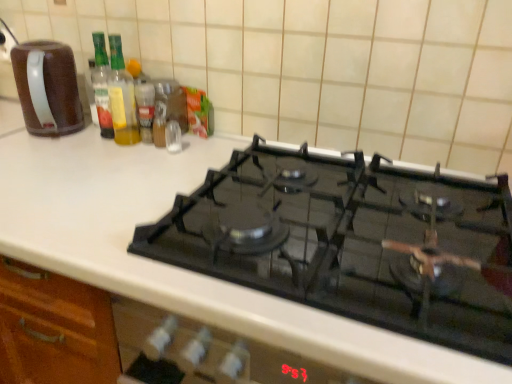
Question: Considering the relative sizes of translucent glass bottle at upper left, which ranks as the first bottle in left-to-right order, and metallic spice container at upper center in the image provided, is translucent glass bottle at upper left, which ranks as the first bottle in left-to-right order, smaller than metallic spice container at upper center?

Choices:
 (A) yes
 (B) no

Answer: (B)

Question: Is translucent glass bottle at upper left, arranged as the second bottle when viewed from the right, with metallic spice container at upper center?

Choices:
 (A) yes
 (B) no

Answer: (B)

Question: From the image's perspective, would you say translucent glass bottle at upper left, arranged as the second bottle when viewed from the right, is shown under metallic spice container at upper center?

Choices:
 (A) yes
 (B) no

Answer: (B)

Question: Considering the relative positions of translucent glass bottle at upper left, which ranks as the first bottle in left-to-right order, and metallic spice container at upper center in the image provided, is translucent glass bottle at upper left, which ranks as the first bottle in left-to-right order, to the left of metallic spice container at upper center from the viewer's perspective?

Choices:
 (A) yes
 (B) no

Answer: (A)

Question: From the image's perspective, is translucent glass bottle at upper left, arranged as the second bottle when viewed from the right, over metallic spice container at upper center?

Choices:
 (A) yes
 (B) no

Answer: (A)

Question: Can you confirm if translucent glass bottle at upper left, arranged as the second bottle when viewed from the right, is positioned to the right of metallic spice container at upper center?

Choices:
 (A) yes
 (B) no

Answer: (B)

Question: From a real-world perspective, is translucent glass spice at center, the 1th bottle from the right, located beneath brown matte coffee pot at left?

Choices:
 (A) yes
 (B) no

Answer: (A)

Question: Does translucent glass spice at center, which is the 2th bottle from left to right, touch brown matte coffee pot at left?

Choices:
 (A) no
 (B) yes

Answer: (A)

Question: Considering the relative sizes of translucent glass spice at center, which is the 2th bottle from left to right, and brown matte coffee pot at left in the image provided, is translucent glass spice at center, which is the 2th bottle from left to right, wider than brown matte coffee pot at left?

Choices:
 (A) no
 (B) yes

Answer: (A)

Question: Is translucent glass spice at center, which is the 2th bottle from left to right, positioned beyond the bounds of brown matte coffee pot at left?

Choices:
 (A) yes
 (B) no

Answer: (A)

Question: Is the position of translucent glass spice at center, the 1th bottle from the right, less distant than that of brown matte coffee pot at left?

Choices:
 (A) no
 (B) yes

Answer: (A)

Question: Is translucent glass spice at center, the 1th bottle from the right, turned away from brown matte coffee pot at left?

Choices:
 (A) yes
 (B) no

Answer: (B)

Question: From the image's perspective, would you say translucent glass spice at center, which is the 2th bottle from left to right, is shown under translucent glass bottle at upper left, arranged as the second bottle when viewed from the right?

Choices:
 (A) yes
 (B) no

Answer: (A)